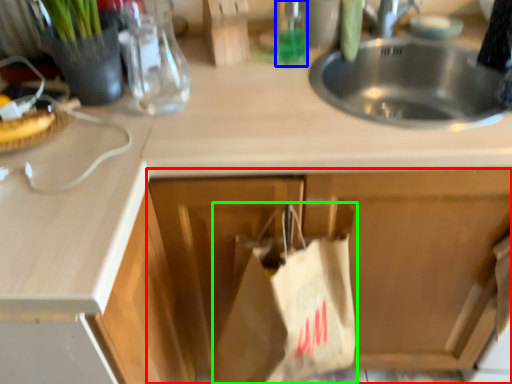
Question: Based on their relative distances, which object is nearer to cabinetry (highlighted by a red box)? Choose from bottle (highlighted by a blue box) and grocery bag (highlighted by a green box).

Choices:
 (A) bottle
 (B) grocery bag

Answer: (B)